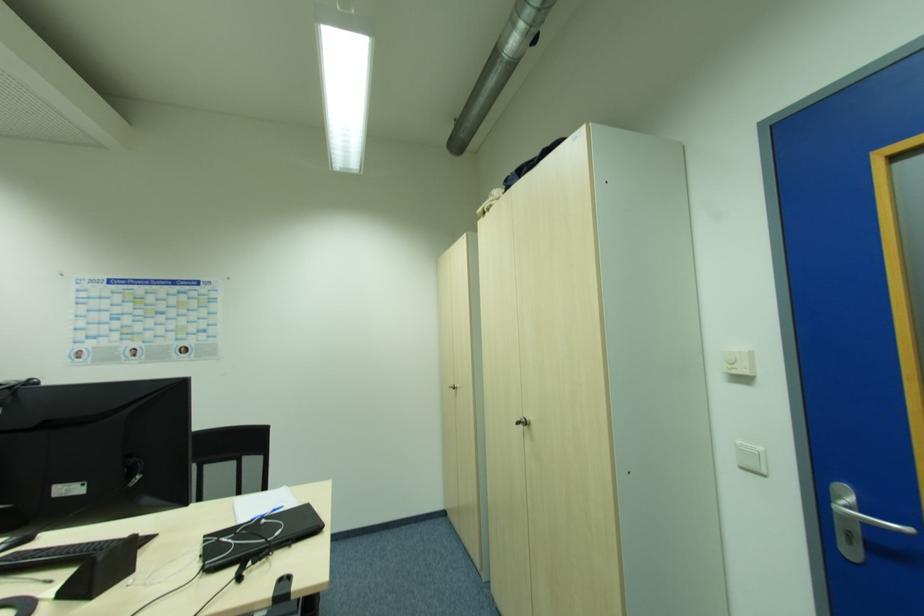
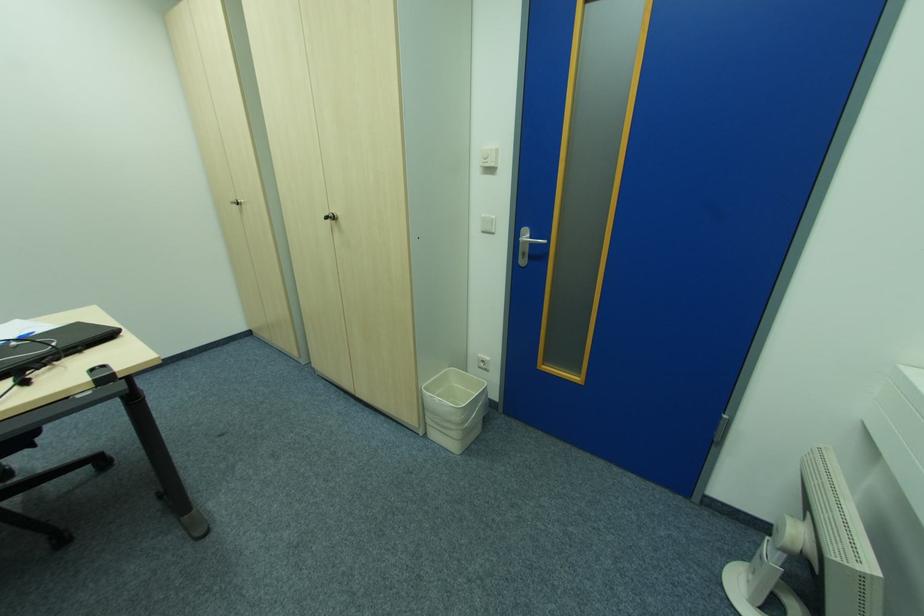
The point at (736, 368) is marked in the first image. Where is the corresponding point in the second image?

(489, 161)